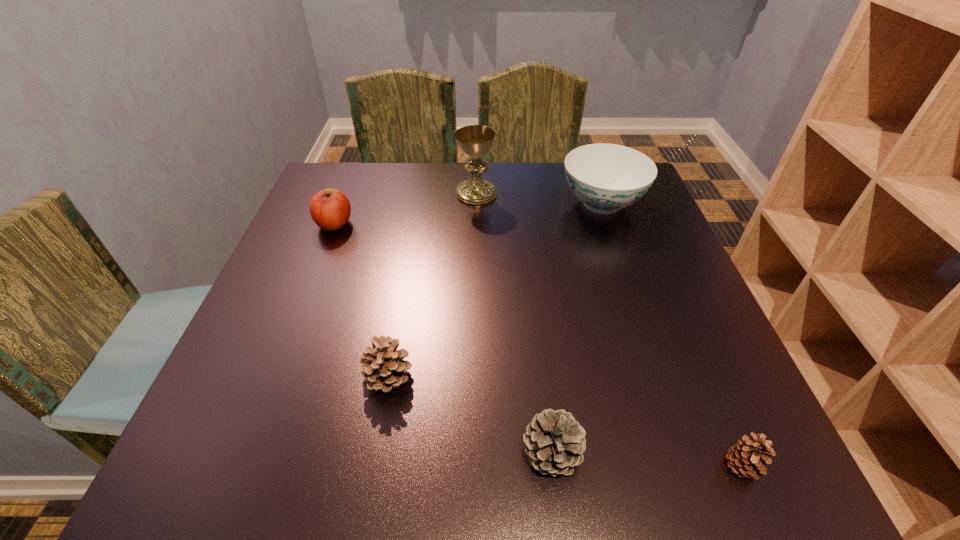
Where is `vacant space situated 0.190m on the front of the chinaware`? Image resolution: width=960 pixels, height=540 pixels. vacant space situated 0.190m on the front of the chinaware is located at coordinates (630, 284).

At what (x,y) coordinates should I click in order to perform the action: click on blank area located on the front of the leftmost object. Please return your answer as a coordinate pair (x, y). Looking at the image, I should click on (279, 366).

At what (x,y) coordinates should I click in order to perform the action: click on free space located 0.370m on the back of the second object from left to right. Please return your answer as a coordinate pair (x, y). Looking at the image, I should click on (413, 230).

Where is `blank space located on the back of the fourth object from left to right`? blank space located on the back of the fourth object from left to right is located at coordinates (529, 260).

Locate an element on the screen. This screenshot has width=960, height=540. vacant region located 0.270m on the back of the rightmost pinecone is located at coordinates [x=678, y=318].

In order to click on chalice that is at the far edge in this screenshot , I will do `click(475, 141)`.

You are a GUI agent. You are given a task and a screenshot of the screen. Output one action in this format:
    pyautogui.click(x=<x>, y=<y>)
    Task: Click on the chinaware situated at the far edge
    This screenshot has height=540, width=960.
    Given the screenshot: What is the action you would take?
    pyautogui.click(x=606, y=177)

Where is `object that is positioned at the left edge`? The image size is (960, 540). object that is positioned at the left edge is located at coordinates (330, 209).

Where is `chinaware at the right edge`? The image size is (960, 540). chinaware at the right edge is located at coordinates (606, 177).

The height and width of the screenshot is (540, 960). What are the coordinates of `pinecone at the right edge` in the screenshot? It's located at (747, 457).